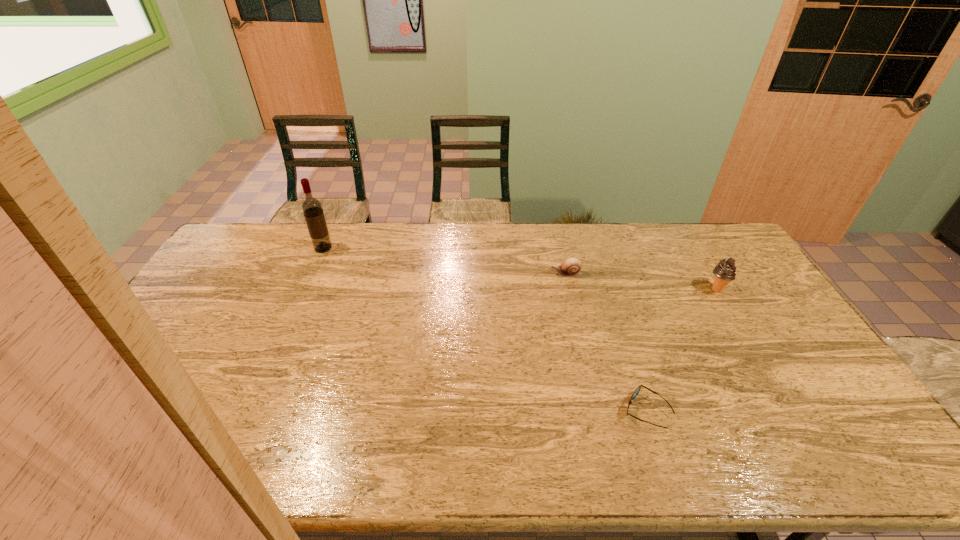
In the image, there is a desktop. At what (x,y) coordinates should I click in order to perform the action: click on vacant space at the far left corner. Please return your answer as a coordinate pair (x, y). The width and height of the screenshot is (960, 540). Looking at the image, I should click on click(243, 230).

I want to click on free region at the near left corner of the desktop, so click(113, 467).

Identify the location of free region at the far right corner. The height and width of the screenshot is (540, 960). (706, 257).

Locate an element on the screen. This screenshot has width=960, height=540. free space between the wine bottle and the rightmost object is located at coordinates (520, 269).

This screenshot has width=960, height=540. In order to click on unoccupied area between the leftmost object and the nearest object in this screenshot , I will do `click(485, 329)`.

The width and height of the screenshot is (960, 540). What are the coordinates of `vacant point located between the leftmost object and the sunglasses` in the screenshot? It's located at (485, 329).

Where is `vacant area that lies between the shortest object and the farthest object`? vacant area that lies between the shortest object and the farthest object is located at coordinates (485, 329).

Locate an element on the screen. Image resolution: width=960 pixels, height=540 pixels. vacant area that lies between the second farthest object and the third farthest object is located at coordinates (641, 282).

You are a GUI agent. You are given a task and a screenshot of the screen. Output one action in this format:
    pyautogui.click(x=<x>, y=<y>)
    Task: Click on the free spot between the wine bottle and the second shortest object
    
    Given the screenshot: What is the action you would take?
    pyautogui.click(x=444, y=261)

The width and height of the screenshot is (960, 540). Find the location of `blank region between the shortest object and the tallest object`. blank region between the shortest object and the tallest object is located at coordinates (485, 329).